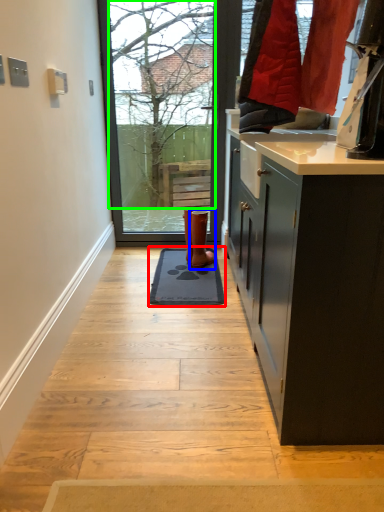
Question: Which object is positioned farthest from doormat (highlighted by a red box)? Select from footwear (highlighted by a blue box) and tree (highlighted by a green box).

Choices:
 (A) footwear
 (B) tree

Answer: (B)